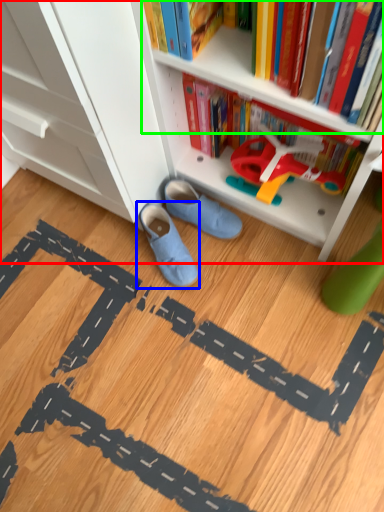
Question: Estimate the real-world distances between objects in this image. Which object is farther from bookcase (highlighted by a red box), footwear (highlighted by a blue box) or book (highlighted by a green box)?

Choices:
 (A) footwear
 (B) book

Answer: (A)